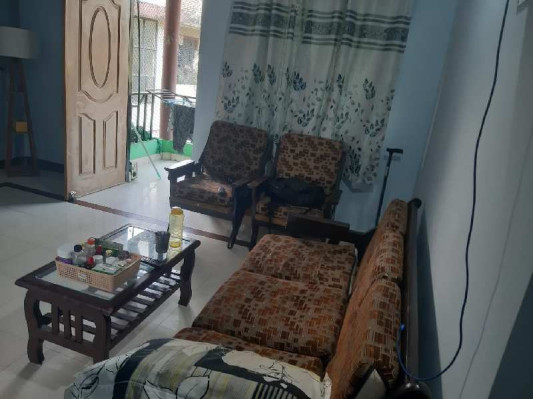
Where is `cup on coffee table`? This screenshot has width=533, height=399. cup on coffee table is located at coordinates (161, 241).